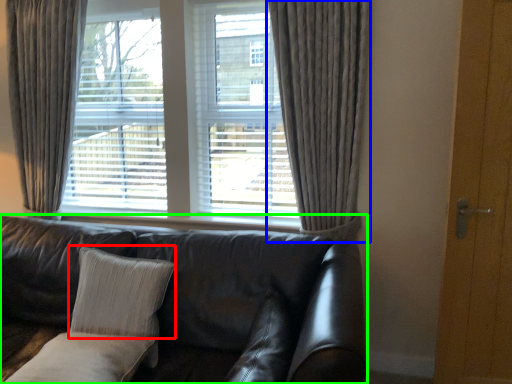
Question: Which is farther away from pillow (highlighted by a red box)? curtain (highlighted by a blue box) or studio couch (highlighted by a green box)?

Choices:
 (A) curtain
 (B) studio couch

Answer: (A)